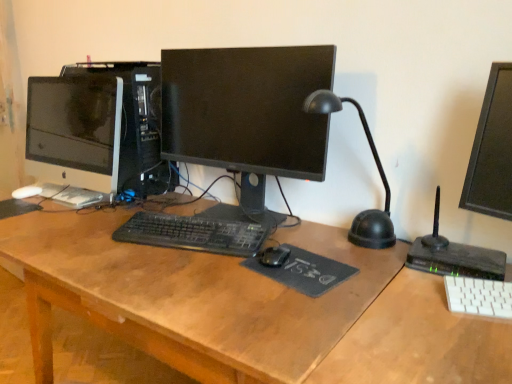
You are a GUI agent. You are given a task and a screenshot of the screen. Output one action in this format:
    pyautogui.click(x=<x>, y=<y>)
    Task: Click on the vacant space behind black fabric mousepad at center, positioned as the 2th mousepad in back-to-front order
    
    Given the screenshot: What is the action you would take?
    pyautogui.click(x=310, y=235)